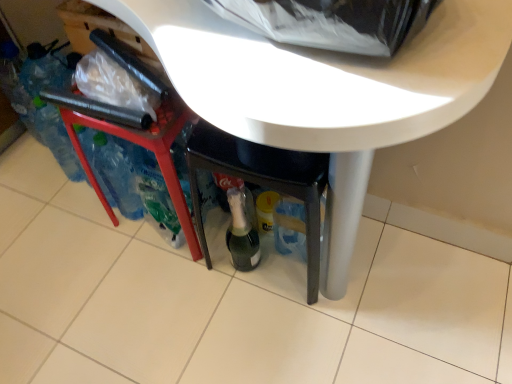
What is the approximate width of white glossy table at center?

white glossy table at center is 17.77 inches in width.

Where is `white glossy table at center`? The width and height of the screenshot is (512, 384). white glossy table at center is located at coordinates (326, 91).

Image resolution: width=512 pixels, height=384 pixels. Describe the element at coordinates (326, 91) in the screenshot. I see `white glossy table at center` at that location.

Find the location of `white glossy table at center`. white glossy table at center is located at coordinates (326, 91).